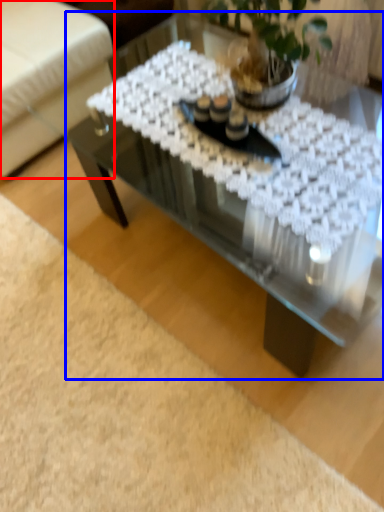
Question: Which of the following is the closest to the observer, armchair (highlighted by a red box) or coffee table (highlighted by a blue box)?

Choices:
 (A) armchair
 (B) coffee table

Answer: (B)